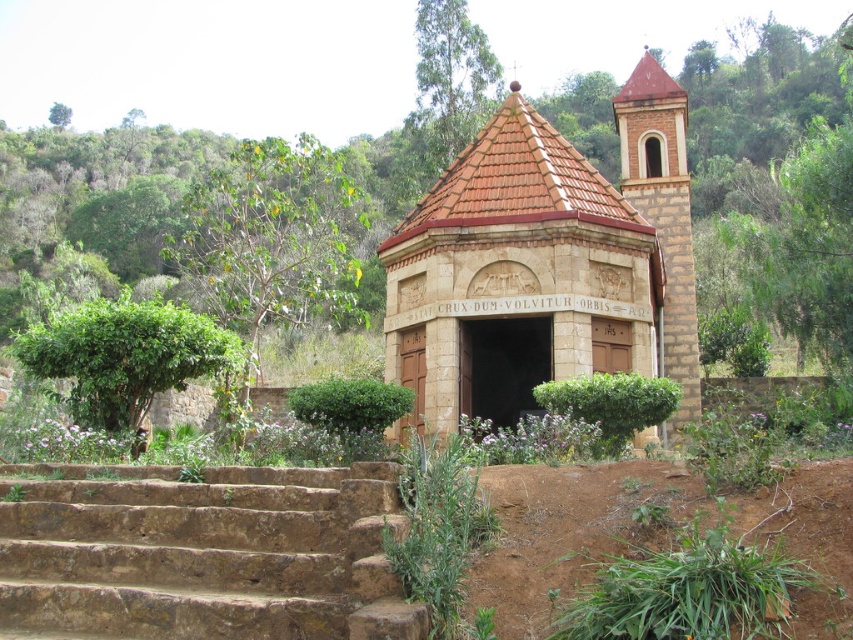
You are standing in front of the chapel and notice two points marked on the structure. The first point is at coordinates point (355,264) and the second is at point (62,122). Which point is nearer to your current position?

Point (355,264) is closer to the camera than point (62,122), so the first point is nearer to your current position.

You are standing at the base of the brown stone stairs at lower left and want to walk towards the green leafy tree at left. Which direction should you go?

To reach the green leafy tree at left from the brown stone stairs at lower left, you should walk towards the left since the tree is positioned to the left of the stairs.